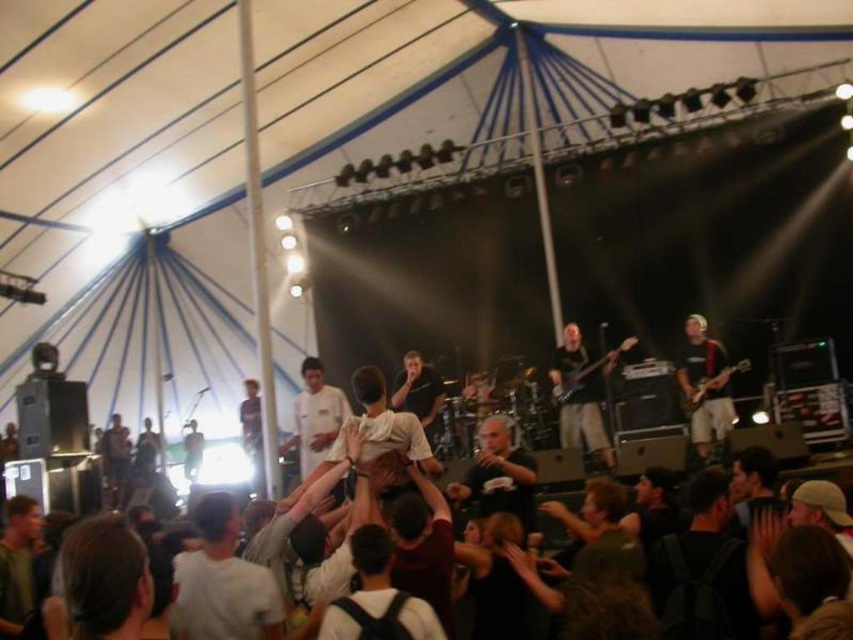
Describe the element at coordinates (498, 474) in the screenshot. I see `dark gray t-shirt at center` at that location.

Between point (521, 513) and point (624, 348), which one is positioned behind?

The point (624, 348) is behind.

Find the location of `dark gray t-shirt at center`. dark gray t-shirt at center is located at coordinates point(498,474).

Who is lower down, dark gray t-shirt at center or black shirt at right?

dark gray t-shirt at center

From the picture: Which is above, dark gray t-shirt at center or black shirt at right?

black shirt at right is higher up.

Locate an element on the screen. This screenshot has height=640, width=853. dark gray t-shirt at center is located at coordinates (498, 474).

Is point (527, 502) in front of point (693, 403)?

Yes, it is.

Does dark gray t-shirt at center lie in front of glossy wood guitar at upper right?

Yes, it is in front of glossy wood guitar at upper right.

Find the location of a particular element. The image size is (853, 640). dark gray t-shirt at center is located at coordinates (498, 474).